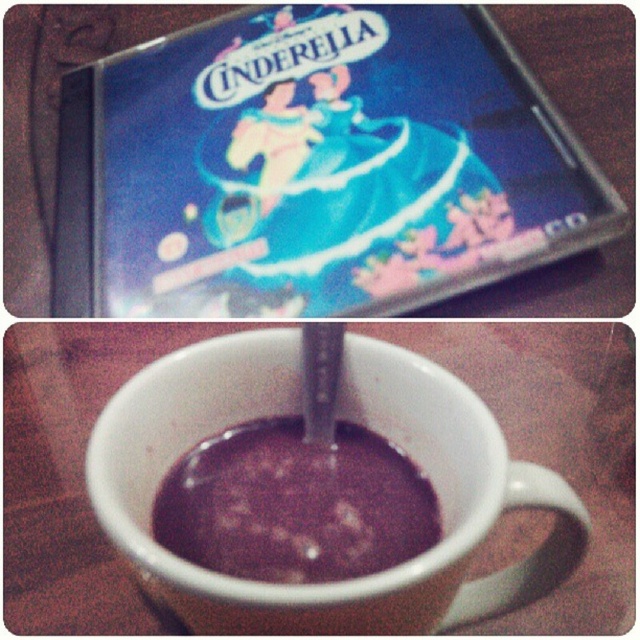
You are at a coffee shop and see a white ceramic mug at center and a dark glossy chocolate at center. You want to place a small spoon between them. Can you fit it there?

The white ceramic mug at center is 1.30 inches away from dark glossy chocolate at center. A small spoon typically measures around 2 inches in length, so it would not fit between them.

You are holding a white ceramic mug at center and want to place it on a shelf above the dark glossy chocolate at center. Is the shelf above the chocolate high enough to accommodate the mug?

The white ceramic mug at center is positioned under dark glossy chocolate at center, meaning the chocolate is above the mug. Since the shelf is above the chocolate, it would be even higher than the mug, so yes, the shelf above the dark glossy chocolate at center can accommodate the white ceramic mug at center.

You are holding a marker and want to draw a dot exactly at the position of the white ceramic mug at center. What coordinates should you aim for?

The white ceramic mug at center is located at coordinates point (342, 419).